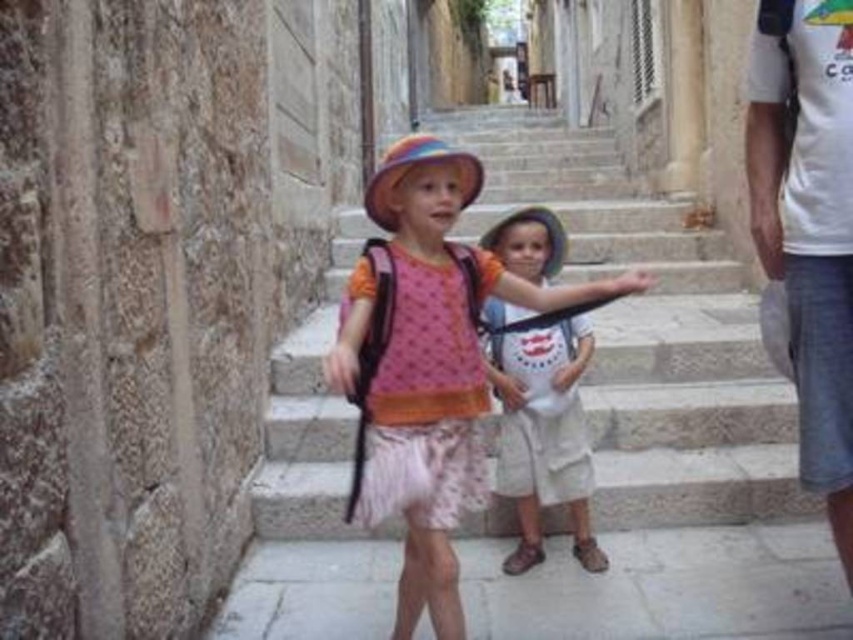
Consider the image. You are standing in the historic stone alleyway and see two points marked in the scene. The first point is at coordinates point (16, 241) and the second point is at point (434, 429). Which point is closer to you?

Point (16, 241) is closer to the camera than point (434, 429), so the first point is closer to you.

You are a photographer trying to capture a photo of the stone stairs at center and the pink fabric dress at center in the historic alleyway. Since you want both objects to appear equally prominent in the photo, which one should you zoom in on more?

The stone stairs at center is larger in size than the pink fabric dress at center, so you should zoom in more on the pink fabric dress at center to make them appear equally prominent.